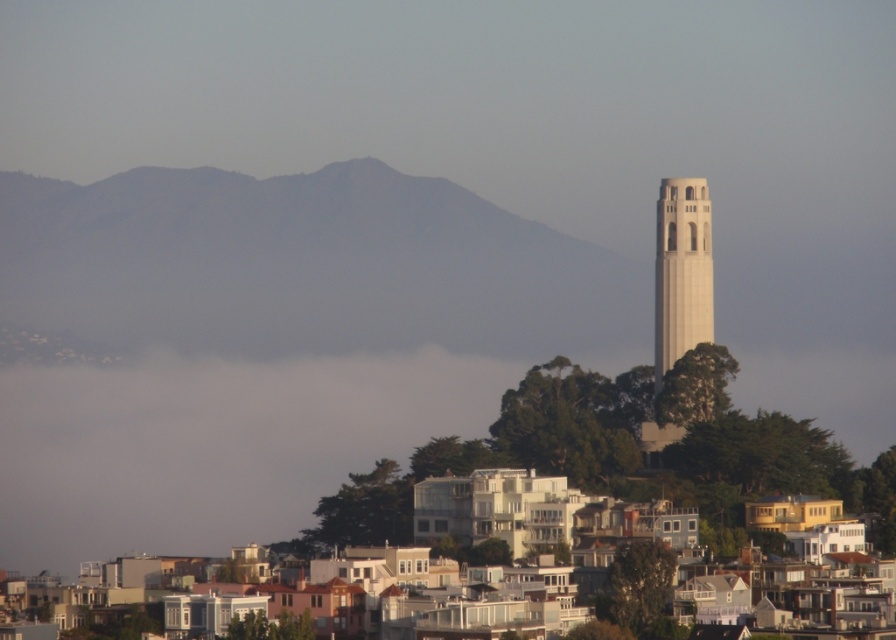
You are a hiker standing at the base of the gray rocky mountain at upper center. You want to reach the top of the Coit Tower visible in the distance. Which direction should you head towards?

You should head towards the upper center direction to reach the top of Coit Tower because the gray rocky mountain at upper center is located at point coordinates (306, 266), which indicates its position in the scene.